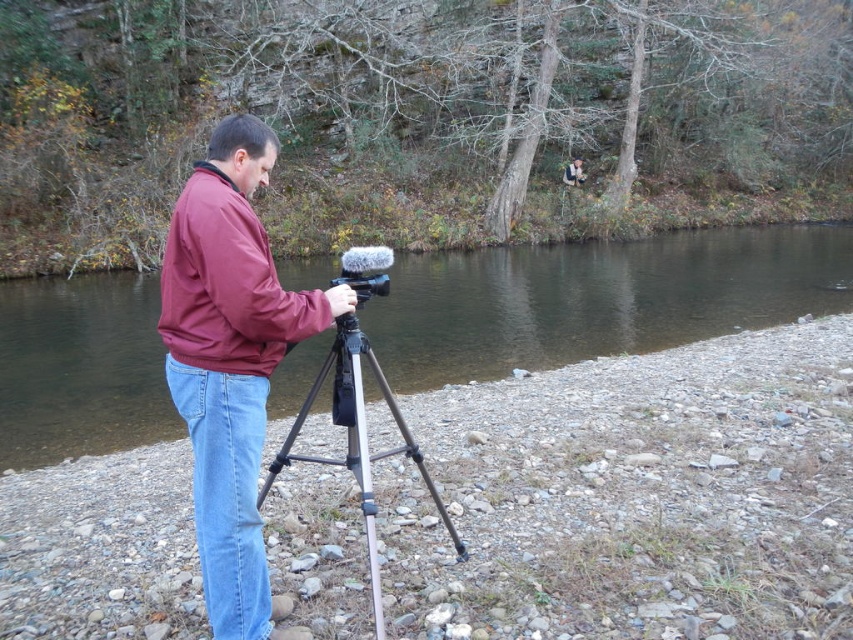
Question: From the image, what is the correct spatial relationship of clear water at center in relation to silver metallic tripod at center?

Choices:
 (A) above
 (B) below

Answer: (A)

Question: Can you confirm if clear water at center is smaller than light blue denim jeans at lower left?

Choices:
 (A) no
 (B) yes

Answer: (A)

Question: Which point is closer to the camera taking this photo?

Choices:
 (A) (193, 256)
 (B) (202, 449)
 (C) (194, 323)

Answer: (A)

Question: Which point is farther from the camera taking this photo?

Choices:
 (A) (378, 380)
 (B) (202, 358)

Answer: (A)

Question: Considering the real-world distances, which object is closest to the clear water at center?

Choices:
 (A) maroon fabric jacket at center
 (B) light blue denim jeans at lower left

Answer: (B)

Question: Considering the relative positions of matte red jacket at center and silver metallic tripod at center in the image provided, where is matte red jacket at center located with respect to silver metallic tripod at center?

Choices:
 (A) left
 (B) right

Answer: (A)